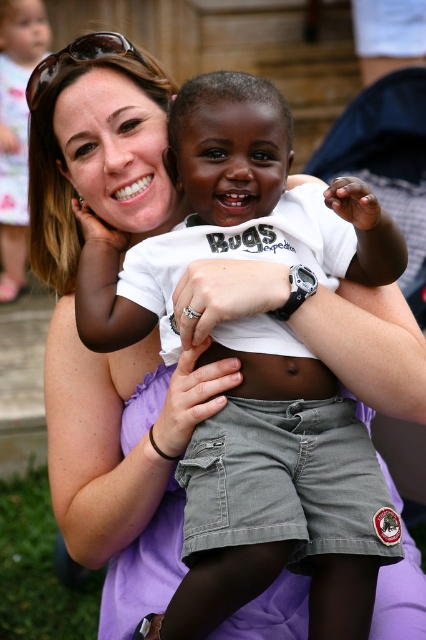
You are a photographer trying to capture the toddler in the image. The toddler is wearing gray cotton shorts at center and has matte black hair at upper left. To frame the shot so the toddler is centered, which object should you adjust your focus towards?

To center the toddler, focus on the gray cotton shorts at center since they are positioned to the right of the matte black hair at upper left, indicating the toddler is located towards that direction.

You are a photographer capturing this moment. You notice the gray cotton shorts at center and the smooth white skin at center. Which object is wider in the image?

The gray cotton shorts at center is wider than the smooth white skin at center in the image.

You are a photographer trying to capture a candid shot of the woman and child in the scene. The matte black hair at upper left and sunglasses at upper left are important elements in the frame. Given the distance between them, can you estimate if you can fit both elements within a standard smartphone camera frame without zooming?

The distance between the matte black hair at upper left and sunglasses at upper left is 9.68 feet. A standard smartphone camera has a field of view that can typically capture objects within 10 feet apart in the same frame. Therefore, both elements can be included in the photo without zooming.